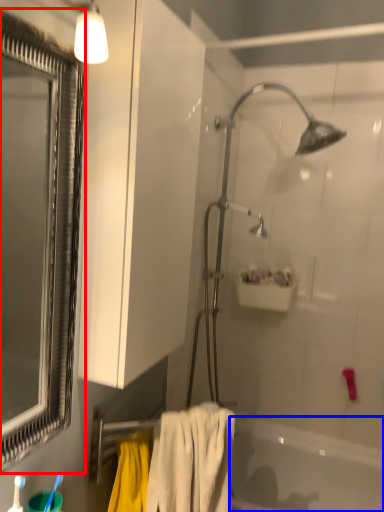
Question: Which object appears closest to the camera in this image, window (highlighted by a red box) or bathtub (highlighted by a blue box)?

Choices:
 (A) window
 (B) bathtub

Answer: (A)